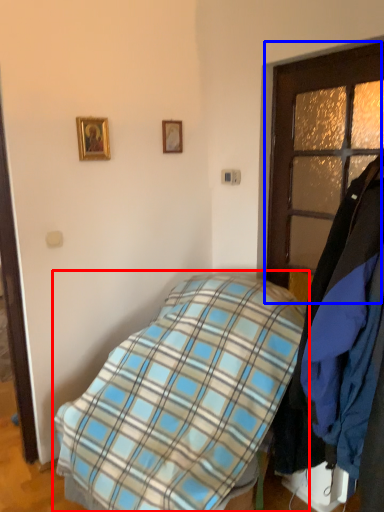
Question: Which object appears closest to the camera in this image, bed (highlighted by a red box) or door (highlighted by a blue box)?

Choices:
 (A) bed
 (B) door

Answer: (A)